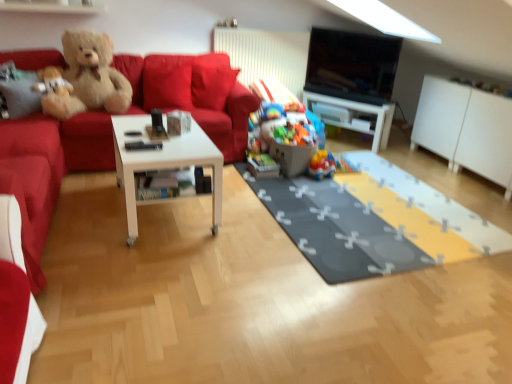
Find the location of a particular element. vacant space to the right of white glossy coffee table at center is located at coordinates (250, 220).